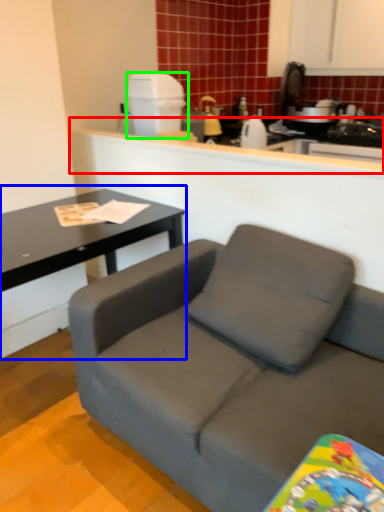
Question: Which is farther away from counter (highlighted by a red box)? coffee table (highlighted by a blue box) or appliance (highlighted by a green box)?

Choices:
 (A) coffee table
 (B) appliance

Answer: (A)